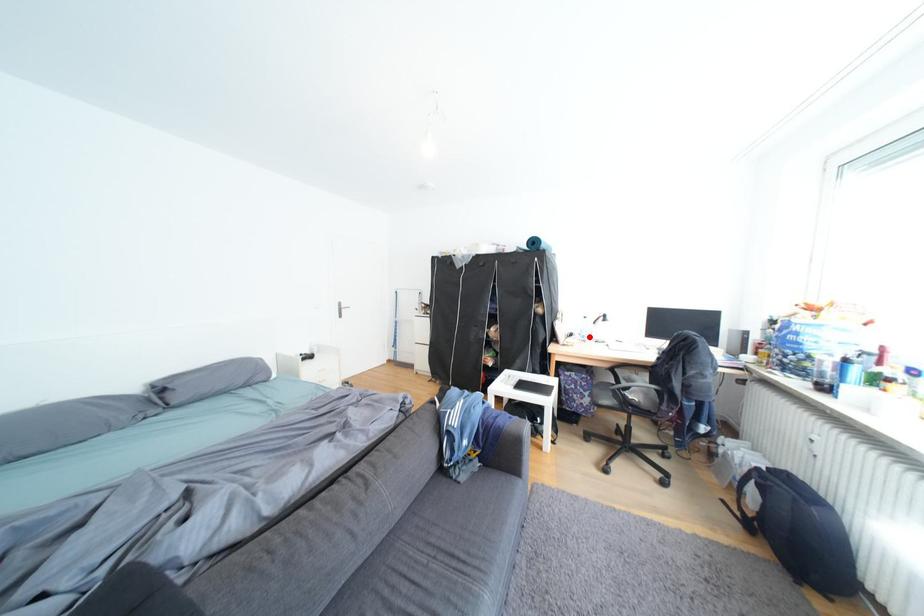
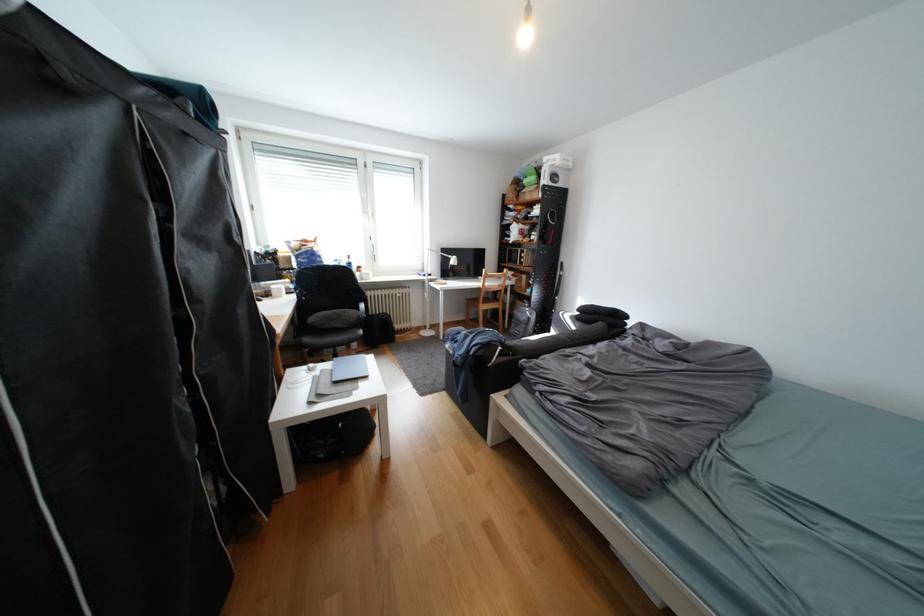
Question: I am providing you with two images of the same scene from different viewpoints. A red point is marked on the first image. Can you still see the location of the red point in image 2?

Choices:
 (A) Yes
 (B) No

Answer: (B)